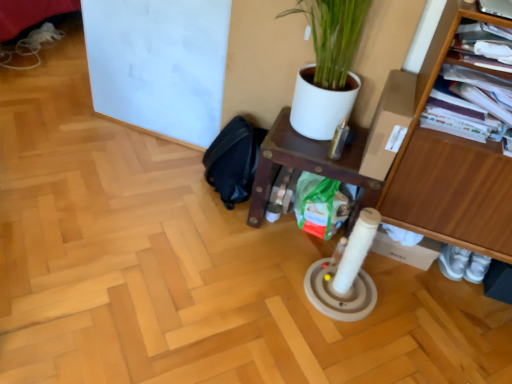
Where is `free space that is to the left of wooden shelf at center`? Image resolution: width=512 pixels, height=384 pixels. free space that is to the left of wooden shelf at center is located at coordinates coord(207,229).